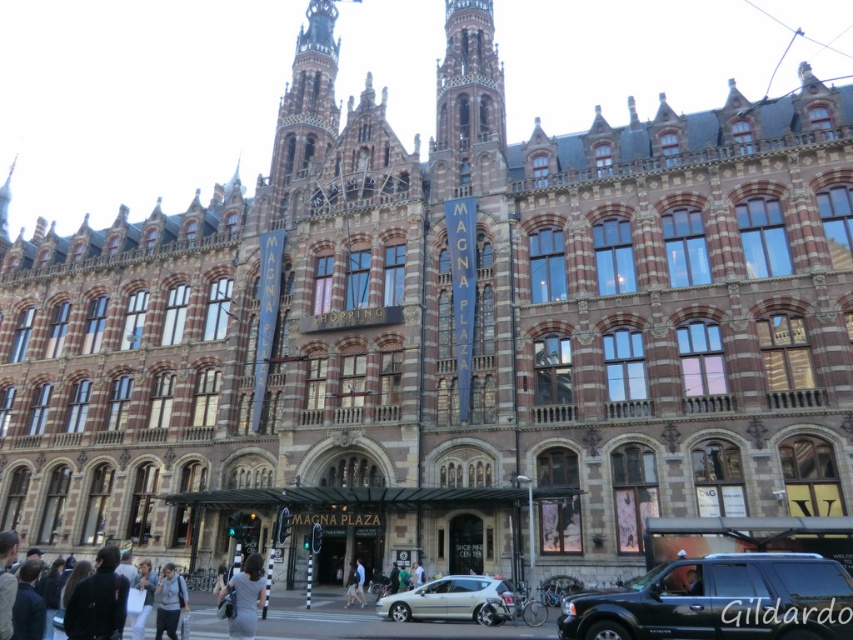
You are standing at the entrance of the MAGNA PLAZA building and want to take a photo of both the silver metallic car at center and the dark gray dress at lower center. Given that your camera has a maximum focus range of 40 feet, will you be able to capture both subjects in focus without moving closer?

The distance between the silver metallic car at center and the dark gray dress at lower center is 42.54 feet. Since your camera can only focus up to 40 feet, you won t be able to capture both subjects in focus without moving closer.

You are standing in front of the grand building and want to determine the relative positions of two points marked on the facade. Which point is closer to you, the point at coordinates (634, 600) or the point at (167, 595)?

Point at coordinates (634, 600) is closer to the viewer than point at coordinates (167, 595).